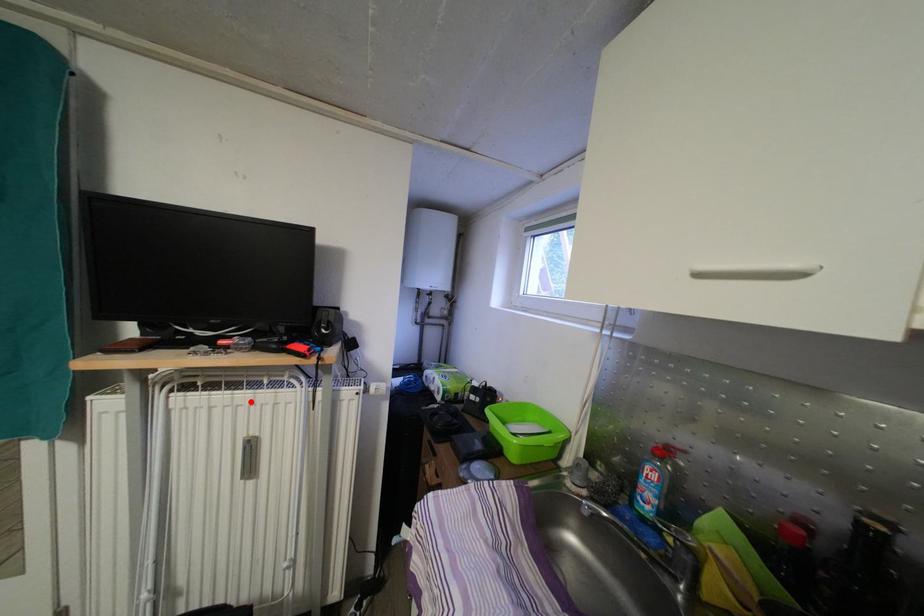
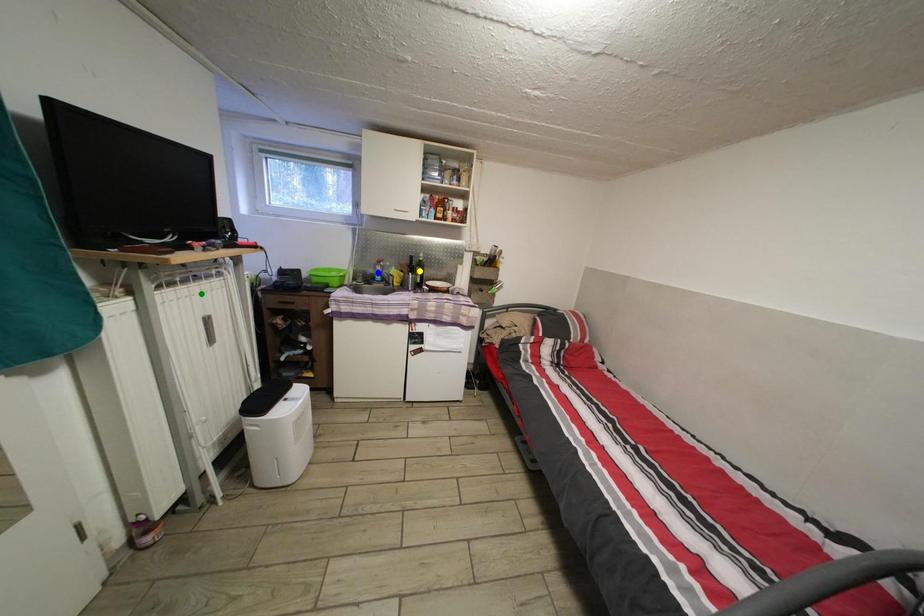
Question: I am providing you with two images of the same scene from different viewpoints. A red point is marked on the first image. You are given multiple points on the second image. Can you choose the point in image 2 that corresponds to the point in image 1?

Choices:
 (A) blue point
 (B) yellow point
 (C) green point

Answer: (C)